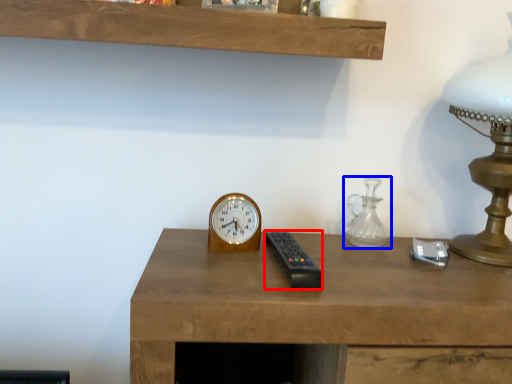
Question: Among these objects, which one is nearest to the camera, control (highlighted by a red box) or glass vase (highlighted by a blue box)?

Choices:
 (A) control
 (B) glass vase

Answer: (A)